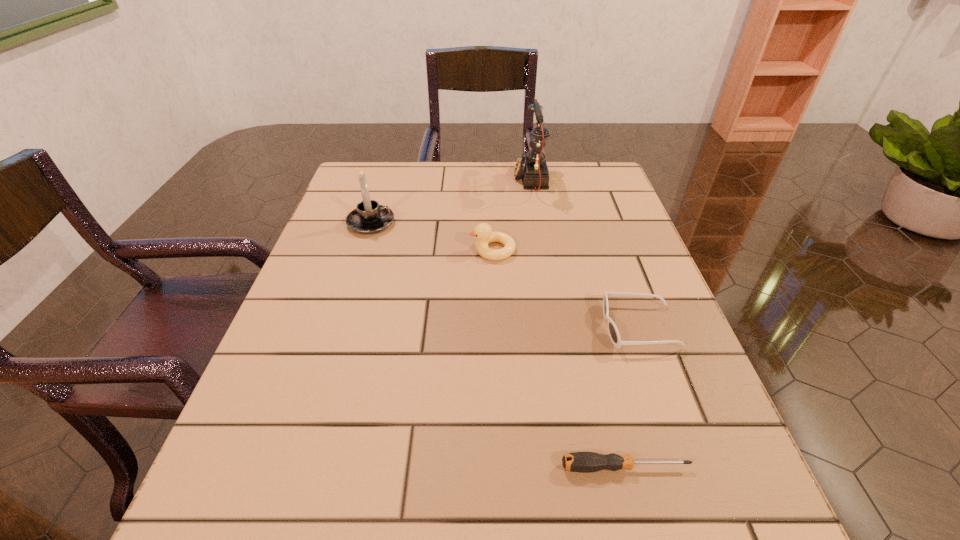
Identify the location of the tallest object. (532, 166).

You are a GUI agent. You are given a task and a screenshot of the screen. Output one action in this format:
    pyautogui.click(x=<x>, y=<y>)
    Task: Click on the telephone
    The image size is (960, 540).
    Given the screenshot: What is the action you would take?
    pyautogui.click(x=532, y=166)

Find the location of `candle holder`. candle holder is located at coordinates (369, 217).

This screenshot has width=960, height=540. Identify the location of the leftmost object. (369, 217).

This screenshot has height=540, width=960. Identify the location of the third farthest object. (483, 232).

Identify the location of the second object from left to right. The image size is (960, 540). (483, 232).

The image size is (960, 540). What are the coordinates of `the fourth farthest object` in the screenshot? It's located at (613, 332).

Where is `the second shortest object`? Image resolution: width=960 pixels, height=540 pixels. the second shortest object is located at coordinates pos(613,332).

The image size is (960, 540). Find the location of `screwdriver`. screwdriver is located at coordinates (x=583, y=462).

Image resolution: width=960 pixels, height=540 pixels. What are the coordinates of `the shortest object` in the screenshot? It's located at (583, 462).